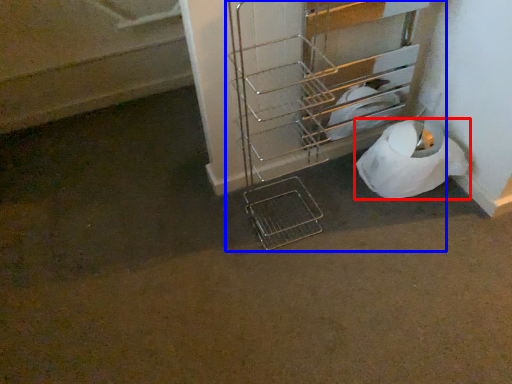
Question: Which of the following is the closest to the observer, toilet paper (highlighted by a red box) or trolley (highlighted by a blue box)?

Choices:
 (A) toilet paper
 (B) trolley

Answer: (B)